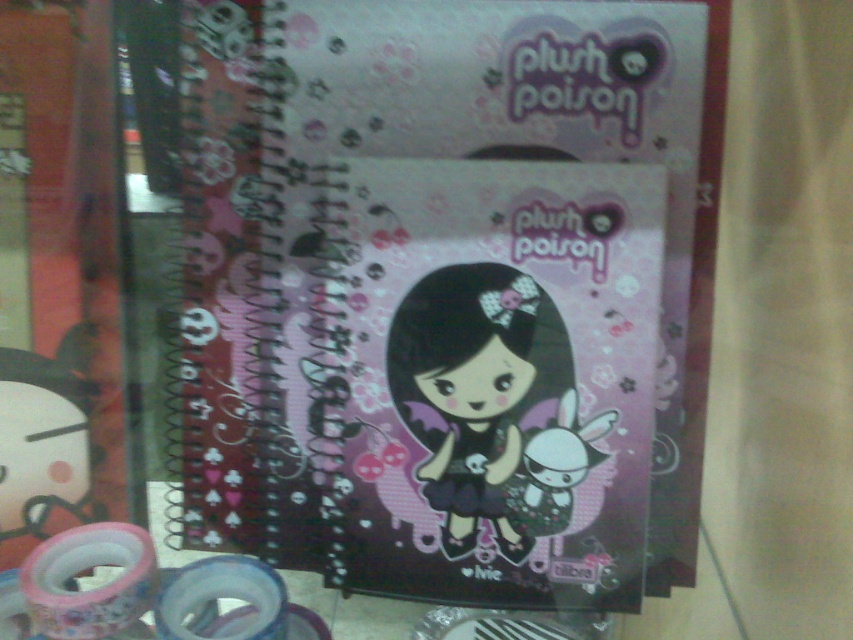
Question: Among these objects, which one is nearest to the camera?

Choices:
 (A) matte black doll at center
 (B) matte pink notebook at center

Answer: (B)

Question: Is matte pink notebook at center behind matte black doll at center?

Choices:
 (A) no
 (B) yes

Answer: (A)

Question: Which point is closer to the camera taking this photo?

Choices:
 (A) (541, 365)
 (B) (631, 216)

Answer: (B)

Question: Does matte pink notebook at center appear on the left side of matte black doll at center?

Choices:
 (A) yes
 (B) no

Answer: (A)

Question: Is matte pink notebook at center bigger than matte black doll at center?

Choices:
 (A) no
 (B) yes

Answer: (B)

Question: Which object is closer to the camera taking this photo?

Choices:
 (A) matte pink notebook at center
 (B) matte black doll at center

Answer: (A)